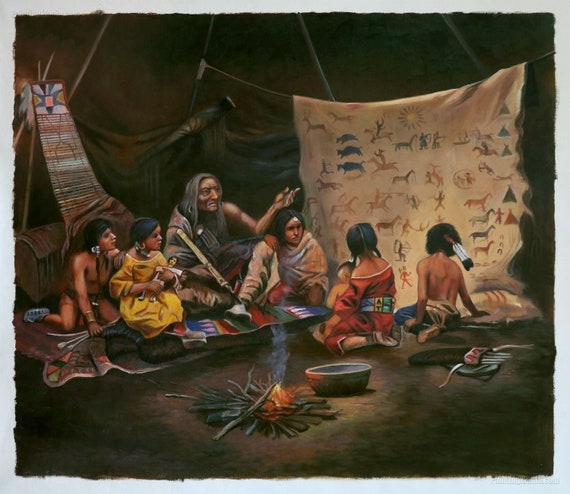
Find the location of a particular element. rug is located at coordinates (81, 360).